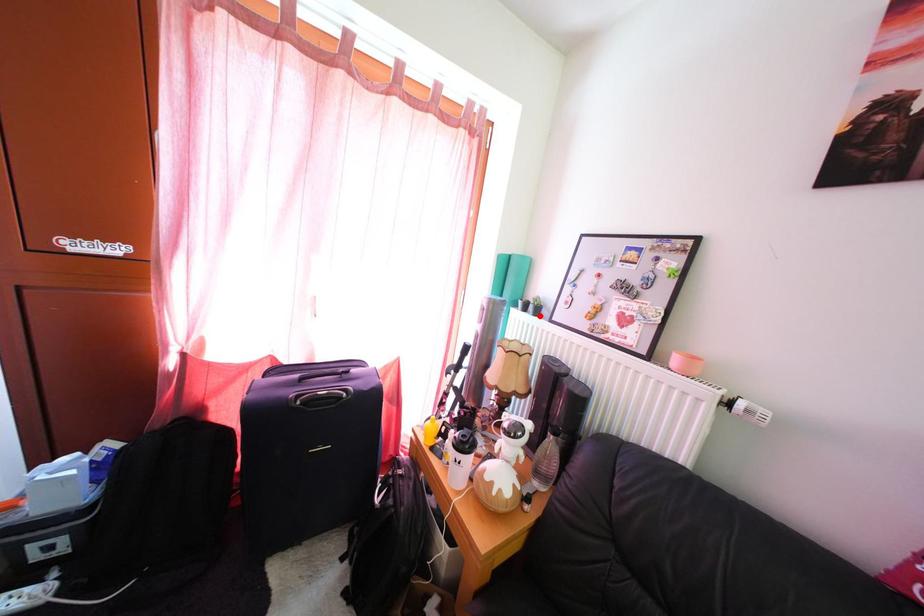
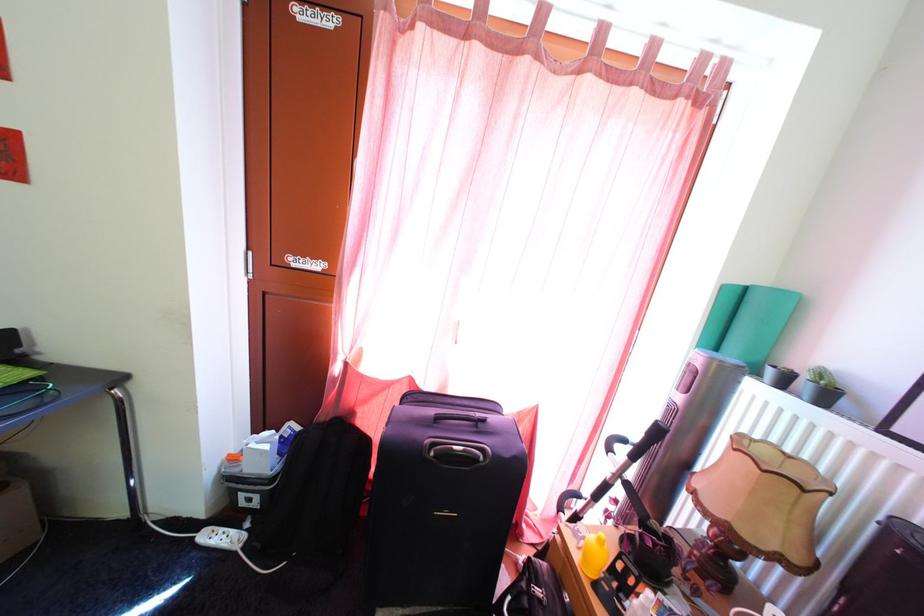
Locate, in the second image, the point that corresponds to the highlighted location in the first image.

(813, 395)